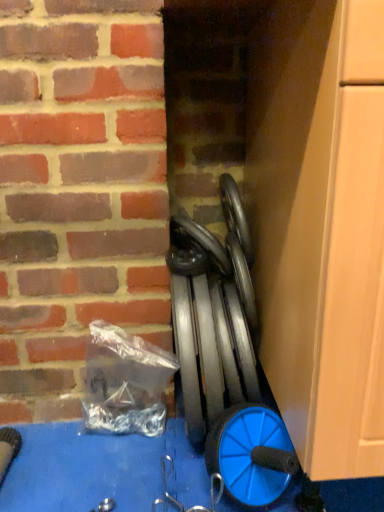
Question: Considering the relative sizes of black rubber car tire at center and metallic gray weights at center in the image provided, is black rubber car tire at center wider than metallic gray weights at center?

Choices:
 (A) yes
 (B) no

Answer: (B)

Question: From a real-world perspective, is black rubber car tire at center physically below metallic gray weights at center?

Choices:
 (A) yes
 (B) no

Answer: (B)

Question: Is black rubber car tire at center further to the viewer compared to metallic gray weights at center?

Choices:
 (A) yes
 (B) no

Answer: (A)

Question: Does black rubber car tire at center have a greater height compared to metallic gray weights at center?

Choices:
 (A) yes
 (B) no

Answer: (B)

Question: Are black rubber car tire at center and metallic gray weights at center making contact?

Choices:
 (A) yes
 (B) no

Answer: (B)

Question: Is black rubber car tire at center outside of metallic gray weights at center?

Choices:
 (A) yes
 (B) no

Answer: (A)

Question: From a real-world perspective, is metallic gray weights at center beneath black rubber car tire at center?

Choices:
 (A) yes
 (B) no

Answer: (A)

Question: Does metallic gray weights at center have a lesser height compared to black rubber car tire at center?

Choices:
 (A) no
 (B) yes

Answer: (A)

Question: Could you tell me if metallic gray weights at center is facing black rubber car tire at center?

Choices:
 (A) yes
 (B) no

Answer: (B)

Question: Is the surface of metallic gray weights at center in direct contact with black rubber car tire at center?

Choices:
 (A) no
 (B) yes

Answer: (A)

Question: Considering the relative sizes of metallic gray weights at center and black rubber car tire at center in the image provided, is metallic gray weights at center bigger than black rubber car tire at center?

Choices:
 (A) yes
 (B) no

Answer: (A)

Question: Is there a large distance between metallic gray weights at center and black rubber car tire at center?

Choices:
 (A) no
 (B) yes

Answer: (A)

Question: Can you confirm if black rubber car tire at center is positioned to the left of blue plastic wheel at lower right?

Choices:
 (A) yes
 (B) no

Answer: (A)